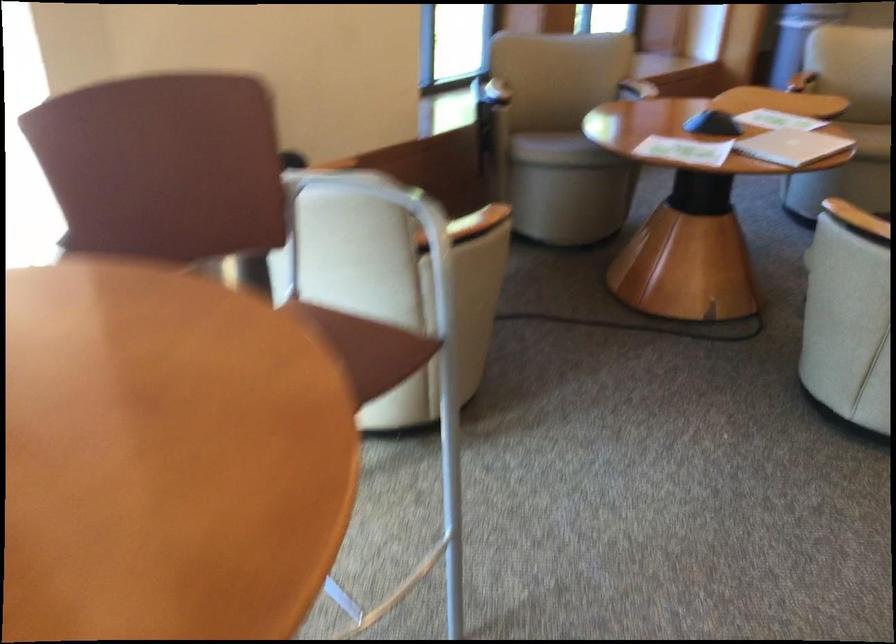
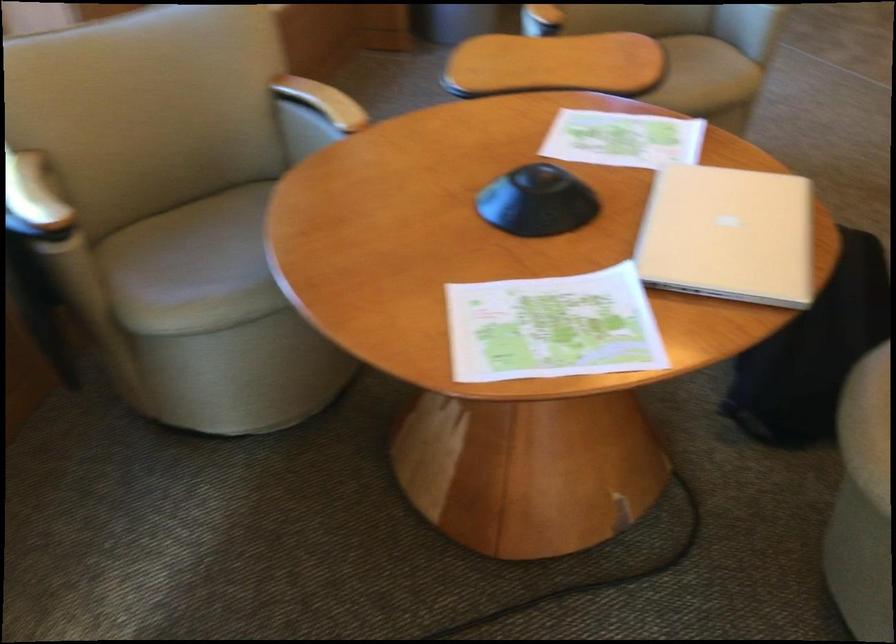
Where in the second image is the point corresponding to the point at 558,131 from the first image?

(193, 267)